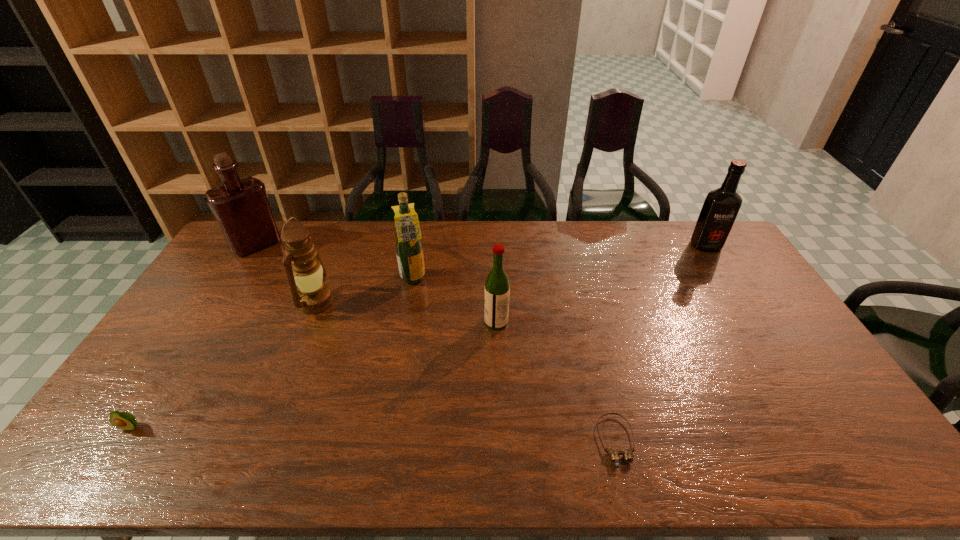
The height and width of the screenshot is (540, 960). What are the coordinates of `vacant space in between the rightmost liquor and the leftmost liquor` in the screenshot? It's located at (481, 245).

The image size is (960, 540). Find the location of `empty space that is in between the shortest object and the rightmost liquor`. empty space that is in between the shortest object and the rightmost liquor is located at coordinates (660, 343).

Where is `free point between the goggles and the leftmost liquor`? free point between the goggles and the leftmost liquor is located at coordinates (436, 343).

Where is `free spot between the fifth object from left to right and the second liquor from left to right`? The width and height of the screenshot is (960, 540). free spot between the fifth object from left to right and the second liquor from left to right is located at coordinates (455, 301).

Locate an element on the screen. The height and width of the screenshot is (540, 960). vacant point located between the second nearest liquor and the third liquor from left to right is located at coordinates (455, 301).

Identify the location of free space between the fifth object from right to left and the third liquor from right to left. The height and width of the screenshot is (540, 960). (365, 291).

Identify which object is the third closest to the second shortest object. Please provide its 2D coordinates. Your answer should be formatted as a tuple, i.e. [(x, y)], where the tuple contains the x and y coordinates of a point satisfying the conditions above.

[(409, 250)]

Locate which object is the third closest to the avocado. Please provide its 2D coordinates. Your answer should be formatted as a tuple, i.e. [(x, y)], where the tuple contains the x and y coordinates of a point satisfying the conditions above.

[(409, 250)]

Point out which liquor is positioned as the second nearest to the nearest liquor. Please provide its 2D coordinates. Your answer should be formatted as a tuple, i.e. [(x, y)], where the tuple contains the x and y coordinates of a point satisfying the conditions above.

[(721, 206)]

Locate an element on the screen. Image resolution: width=960 pixels, height=540 pixels. liquor that is the closest to the goggles is located at coordinates [x=497, y=286].